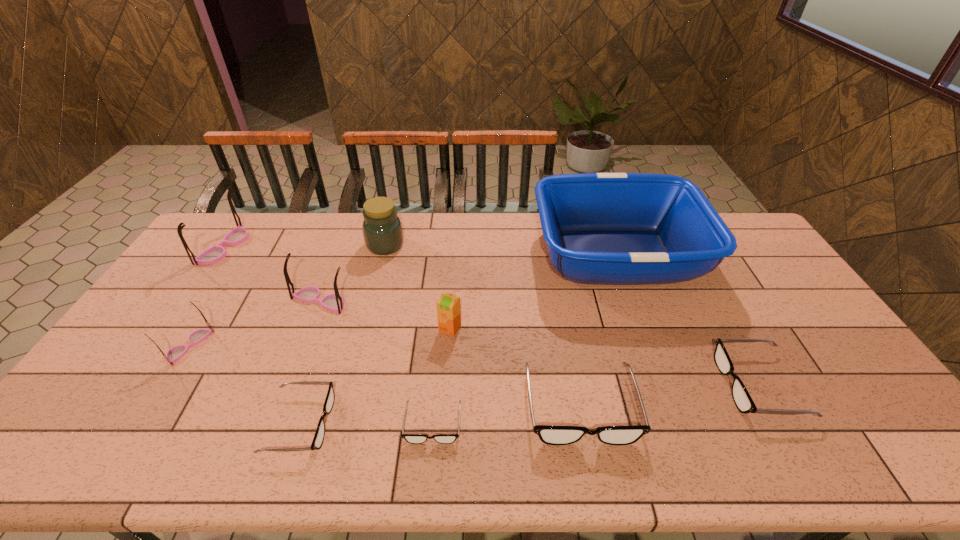
Locate an element on the screen. This screenshot has width=960, height=540. object located in the far left corner section of the desktop is located at coordinates (214, 254).

Identify the location of vacant region at the far edge of the desktop. (458, 220).

At what (x,y) coordinates should I click in order to perform the action: click on free space at the near edge. Please return your answer as a coordinate pair (x, y). The width and height of the screenshot is (960, 540). Looking at the image, I should click on (636, 447).

You are a GUI agent. You are given a task and a screenshot of the screen. Output one action in this format:
    pyautogui.click(x=<x>, y=<y>)
    Task: Click on the vacant space at the left edge
    
    Given the screenshot: What is the action you would take?
    pyautogui.click(x=175, y=293)

At what (x,y) coordinates should I click in order to perform the action: click on free spot at the right edge of the desktop. Please return your answer as a coordinate pair (x, y). Looking at the image, I should click on (761, 297).

Locate an element on the screen. This screenshot has width=960, height=540. free point between the second tallest spectacles and the third black spectacles from left to right is located at coordinates (450, 354).

Locate an element on the screen. The width and height of the screenshot is (960, 540). blank region between the green jar and the third black spectacles from left to right is located at coordinates (483, 326).

Identify the location of free space between the second farthest pink spectacles and the second black spectacles from right to left. (450, 354).

The width and height of the screenshot is (960, 540). In order to click on vacant point located between the orange juice and the third biggest black spectacles in this screenshot , I will do `click(375, 376)`.

You are a GUI agent. You are given a task and a screenshot of the screen. Output one action in this format:
    pyautogui.click(x=<x>, y=<y>)
    Task: Click on the free space between the second smallest pink spectacles and the farthest pink spectacles
    
    Given the screenshot: What is the action you would take?
    pyautogui.click(x=272, y=274)